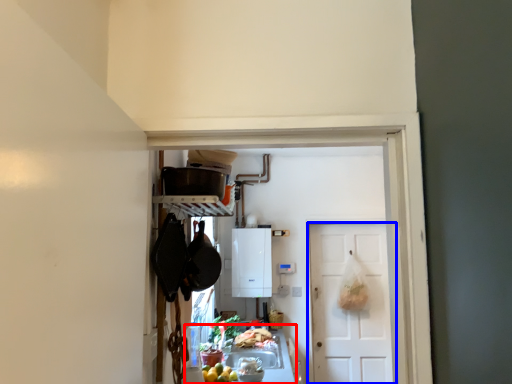
Question: Which of the following is the farthest to the observer, counter top (highlighted by a red box) or door (highlighted by a blue box)?

Choices:
 (A) counter top
 (B) door

Answer: (B)